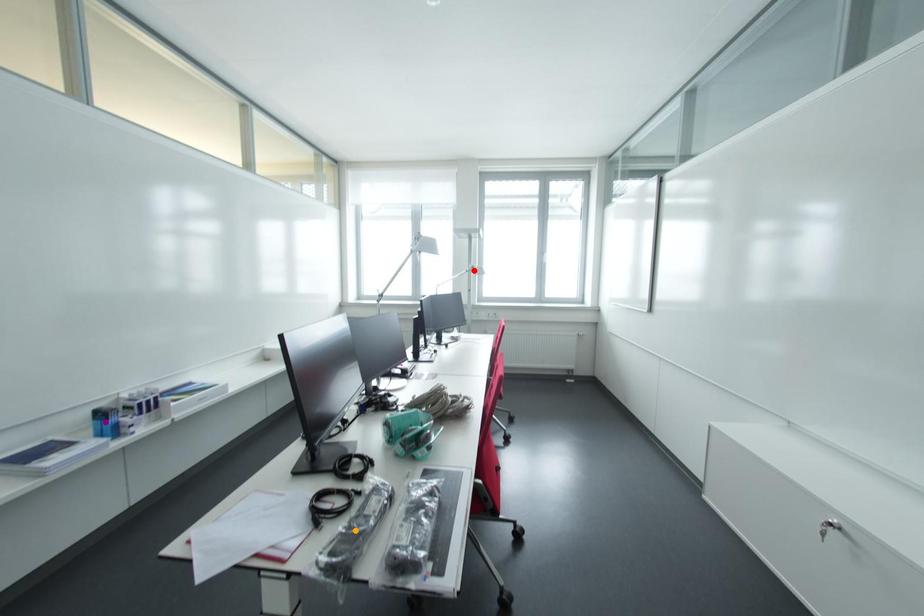
Order these from nearest to farthest:
A) orange point
B) purple point
C) red point

orange point → purple point → red point